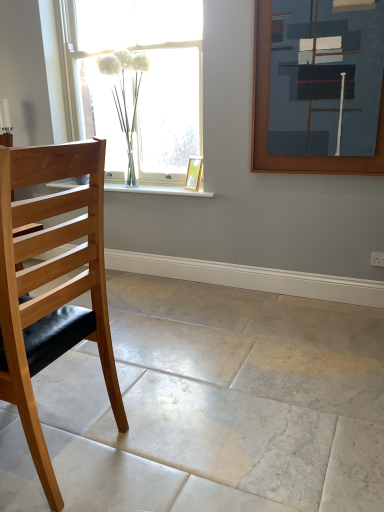
Question: Does point (147, 69) appear closer or farther from the camera than point (187, 181)?

Choices:
 (A) farther
 (B) closer

Answer: (B)

Question: In terms of width, does white glass vase at upper center look wider or thinner when compared to gold metallic picture frame at window, acting as the second picture frame starting from the front?

Choices:
 (A) wide
 (B) thin

Answer: (A)

Question: Based on their relative distances, which object is farther from the white marble floor at lower left?

Choices:
 (A) brown wooden picture frame at upper right, the 2th picture frame in the left-to-right sequence
 (B) white marble window sill at center
 (C) white glass vase at upper center
 (D) light wood/black leather chair at left
 (E) gold metallic picture frame at window, the 1th picture frame in the left-to-right sequence

Answer: (C)

Question: Considering the real-world distances, which object is farthest from the white marble floor at lower left?

Choices:
 (A) light wood/black leather chair at left
 (B) white marble window sill at center
 (C) brown wooden picture frame at upper right, marked as the 2th picture frame in a back-to-front arrangement
 (D) gold metallic picture frame at window, arranged as the first picture frame when viewed from the back
 (E) white glass vase at upper center

Answer: (E)